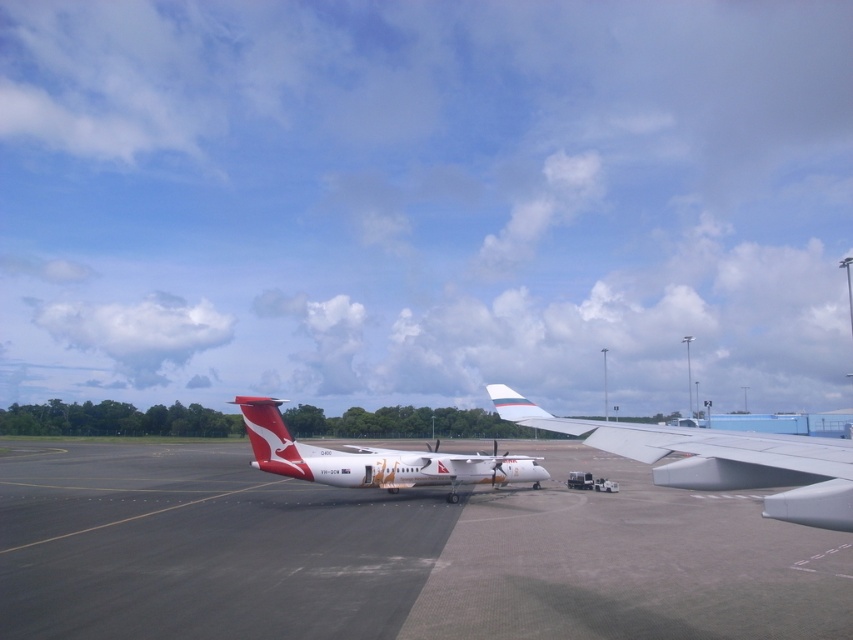
You are a maintenance worker on the airport tarmac. You need to inspect both the white glossy wing at center and the polished red tail at center. Which object should you check first if you want to start with the one nearest to you?

The white glossy wing at center is closer to the viewer than the polished red tail at center, so you should check the white glossy wing at center first.

You are a maintenance worker on the airport tarmac. You need to inspect both the white glossy wing at center and the polished red tail at center. Which object requires you to use a ladder to reach its top surface?

The white glossy wing at center requires a ladder to reach its top surface because it is much taller than the polished red tail at center.

You are a luggage cart that is 1.2 meters wide. You need to move from the left side of the image to the right side. There is a smooth asphalt tarmac at center and a polished red tail at center. Can you pass through the space between them without touching either?

The smooth asphalt tarmac at center might be wider than polished red tail at center, so the space between them may be sufficient for the luggage cart to pass through. However, the exact width is uncertain based on the provided information.